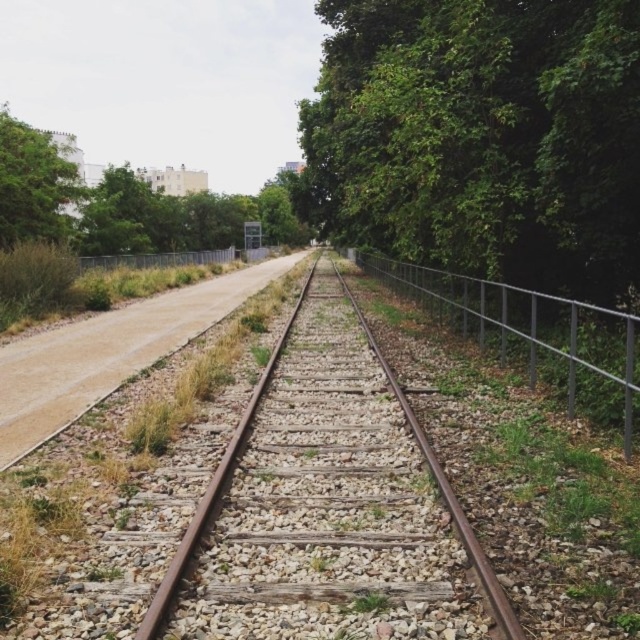
Does point (90, 404) come in front of point (497, 339)?

Yes.

Can you confirm if brown gravel dirt track at left is positioned above metallic rail at center?

No.

Between point (211, 300) and point (502, 300), which one is positioned in front?

Point (502, 300)

Locate an element on the screen. This screenshot has height=640, width=640. brown gravel dirt track at left is located at coordinates (108, 353).

Can you confirm if green leafy tree at center is positioned to the left of brown metal train track at center?

No, green leafy tree at center is not to the left of brown metal train track at center.

Is point (460, 212) closer to viewer compared to point (305, 593)?

No, (460, 212) is behind (305, 593).

Who is more forward, (518,28) or (424,600)?

Point (424,600) is in front.

Where is `green leafy tree at center`? green leafy tree at center is located at coordinates (481, 138).

Is metallic rail at center bigger than green leafy tree at upper left?

No.

Can you confirm if metallic rail at center is smaller than green leafy tree at upper left?

Yes, metallic rail at center is smaller than green leafy tree at upper left.

I want to click on metallic rail at center, so click(x=532, y=333).